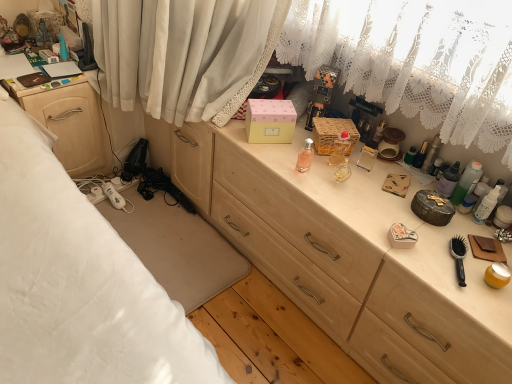
The image size is (512, 384). I want to click on blank space to the left of translucent glass perfume at center, acting as the second toiletry starting from the left, so click(x=276, y=147).